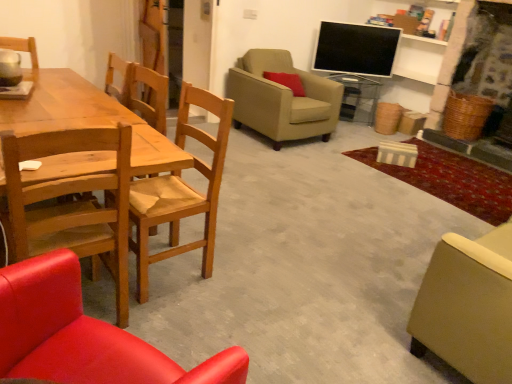
Identify the location of vacant space to the right of wooden chair at left, which appears as the second chair when viewed from the back. This screenshot has height=384, width=512. (242, 272).